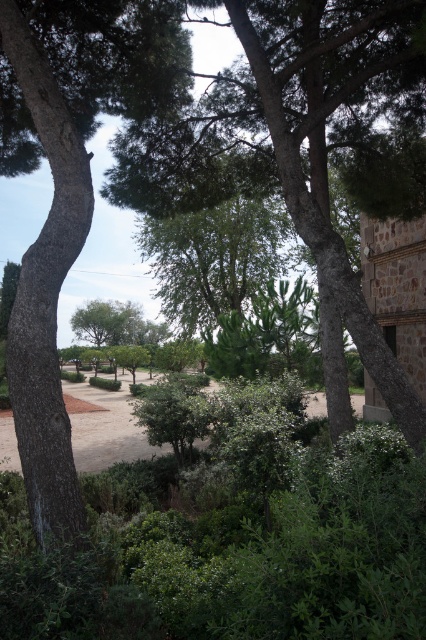
You are planning to plant a new tree in this outdoor area. The green leafy tree at center and the green rough bark tree at left are already present. Based on their current space occupation, which tree might be more suitable for planting a new tree nearby without overcrowding the area?

The green leafy tree at center occupies less space than the green rough bark tree at left, so planting a new tree near the green leafy tree at center would be more suitable to avoid overcrowding.

You are a hiker standing on the sandy pathway and want to take a photo of both the green rough bark tree at left and the brown dirt field at center. Which object will appear larger in the photo?

The green rough bark tree at left will appear larger in the photo because it is much taller than the brown dirt field at center.